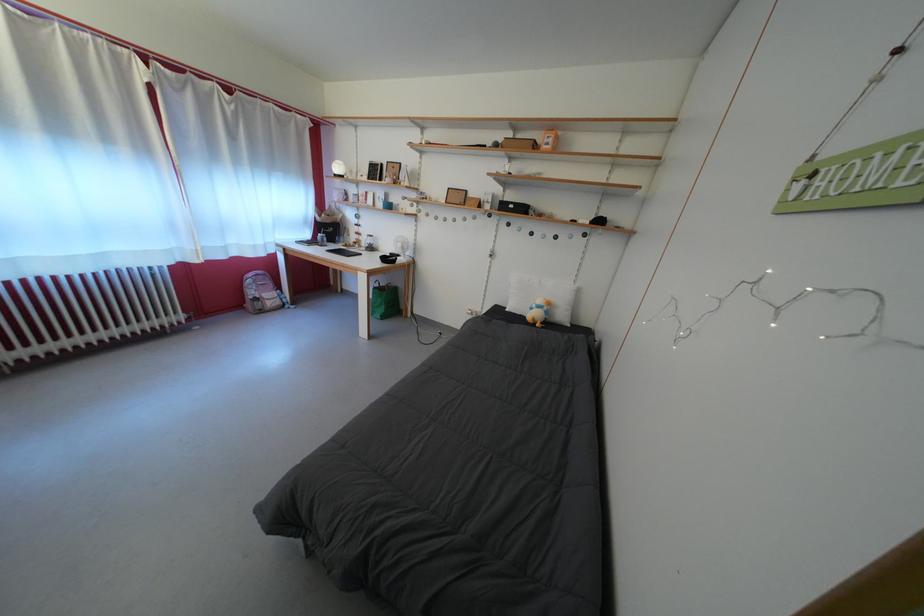
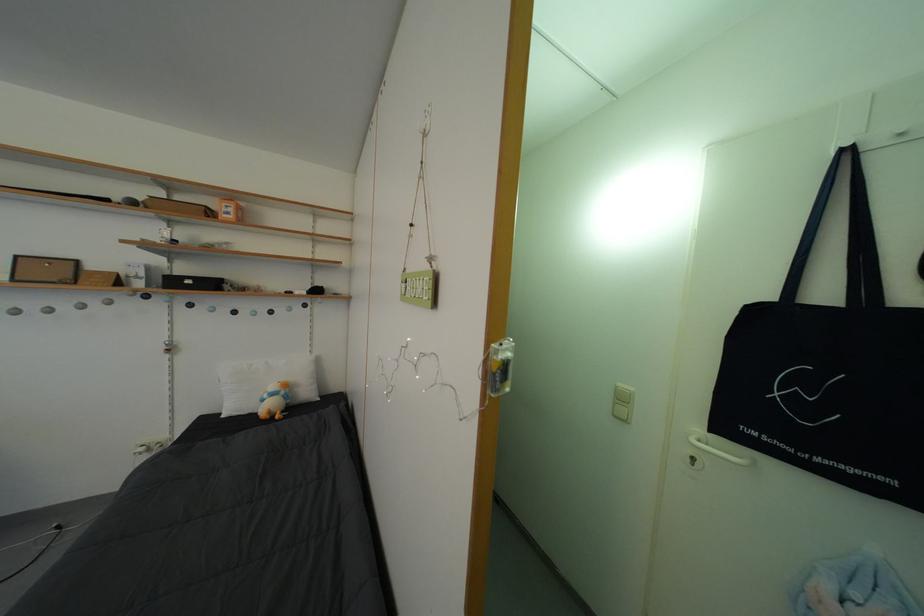
Question: The camera is either moving clockwise (left) or counter-clockwise (right) around the object. The first image is from the beginning of the video and the second image is from the end. Is the camera moving left or right when shooting the video?

Choices:
 (A) Left
 (B) Right

Answer: (A)